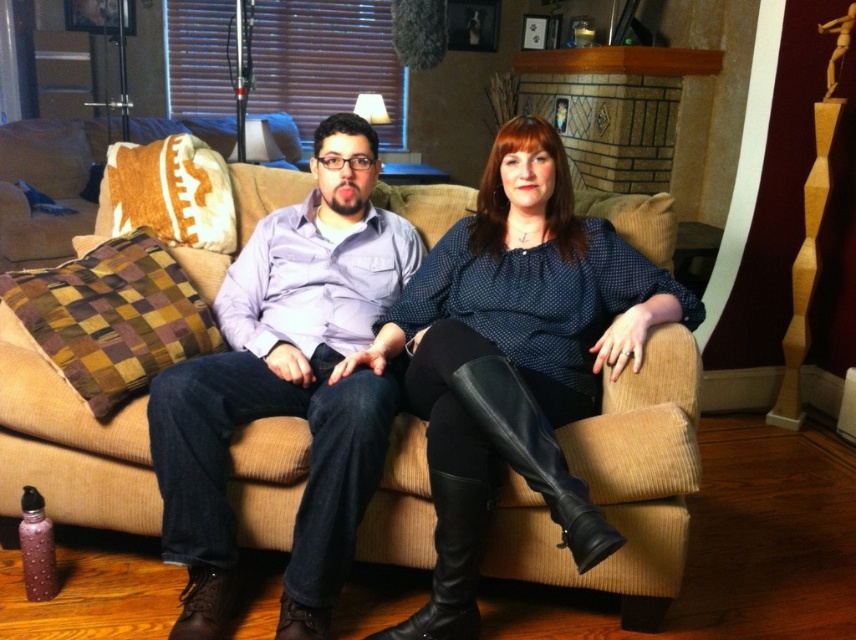
This screenshot has height=640, width=856. Find the location of `matte black boots at center`. matte black boots at center is located at coordinates (516, 358).

Does point (504, 396) come in front of point (296, 532)?

Yes, point (504, 396) is in front of point (296, 532).

Who is more forward, (645, 314) or (287, 330)?

Point (645, 314) is more forward.

Identify the location of matte black boots at center. Image resolution: width=856 pixels, height=640 pixels. (516, 358).

Does beige corduroy couch at center have a greater width compared to matte purple shirt at center?

Yes.

Between beige corduroy couch at center and matte purple shirt at center, which one has more height?

matte purple shirt at center is taller.

Is point (75, 396) positioned in front of point (389, 374)?

Yes, it is in front of point (389, 374).

Where is `beige corduroy couch at center`? beige corduroy couch at center is located at coordinates (619, 484).

Who is more forward, (215,260) or (601,324)?

Point (601,324) is in front.

Can you confirm if beige corduroy couch at center is thinner than matte black boots at center?

No, beige corduroy couch at center is not thinner than matte black boots at center.

What are the coordinates of `beige corduroy couch at center` in the screenshot? It's located at (619, 484).